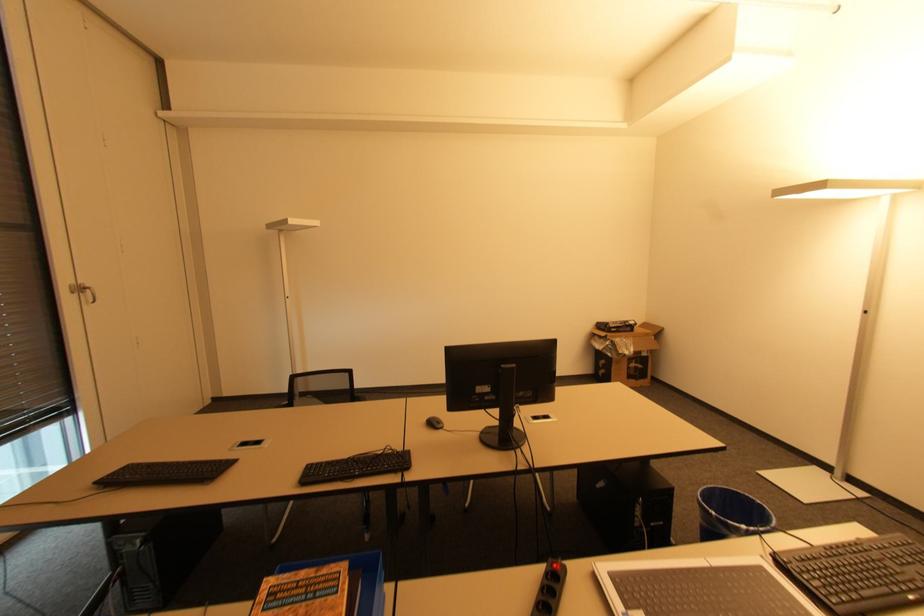
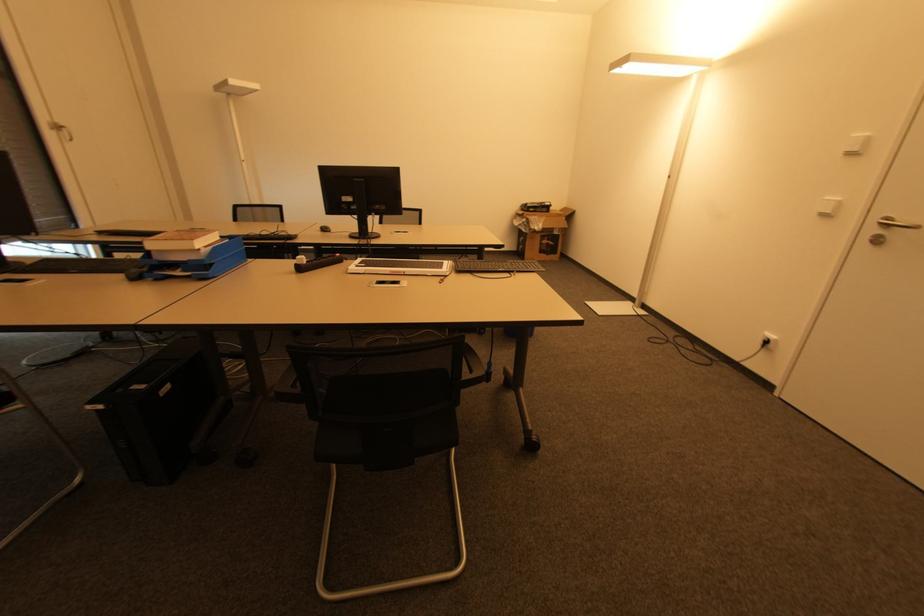
Find the pixel in the second image that matches point 434,424 in the first image.

(325, 230)